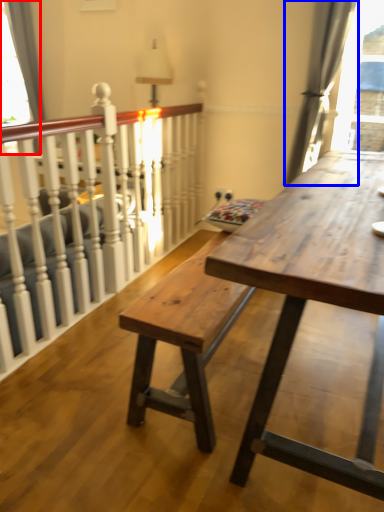
Question: Which of the following is the farthest to the observer, window (highlighted by a red box) or curtain (highlighted by a blue box)?

Choices:
 (A) window
 (B) curtain

Answer: (A)